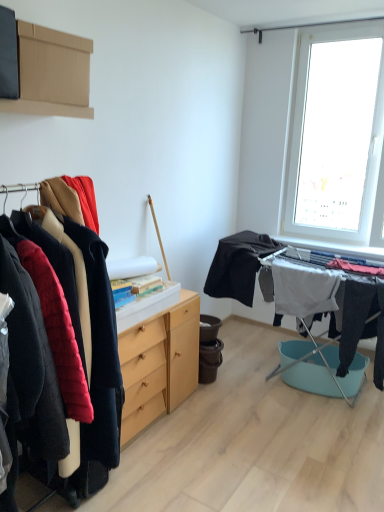
Question: From the image's perspective, does black matte fabric at center, the 2th clothing in the right-to-left sequence, appear higher than white fabric at center, the first clothing in the right-to-left sequence?

Choices:
 (A) no
 (B) yes

Answer: (B)

Question: Is white fabric at center, the 2th clothing viewed from the left, located within black matte fabric at center, the 2th clothing in the right-to-left sequence?

Choices:
 (A) yes
 (B) no

Answer: (B)

Question: Is black matte fabric at center, the 2th clothing in the right-to-left sequence, facing towards white fabric at center, the 2th clothing viewed from the left?

Choices:
 (A) yes
 (B) no

Answer: (B)

Question: Considering the relative positions of black matte fabric at center, the 2th clothing in the right-to-left sequence, and white fabric at center, the first clothing in the right-to-left sequence, in the image provided, is black matte fabric at center, the 2th clothing in the right-to-left sequence, to the right of white fabric at center, the first clothing in the right-to-left sequence, from the viewer's perspective?

Choices:
 (A) yes
 (B) no

Answer: (B)

Question: Is black matte fabric at center, which appears as the 1th clothing when viewed from the left, thinner than white fabric at center, the 2th clothing viewed from the left?

Choices:
 (A) no
 (B) yes

Answer: (A)

Question: Considering the positions of light wood chest of drawers at center and white fabric at center, the first clothing in the right-to-left sequence, in the image, is light wood chest of drawers at center wider or thinner than white fabric at center, the first clothing in the right-to-left sequence,?

Choices:
 (A) thin
 (B) wide

Answer: (B)

Question: Would you say light wood chest of drawers at center is to the left or to the right of white fabric at center, the 2th clothing viewed from the left, in the picture?

Choices:
 (A) left
 (B) right

Answer: (A)

Question: From a real-world perspective, is light wood chest of drawers at center physically located above or below white fabric at center, the first clothing in the right-to-left sequence?

Choices:
 (A) above
 (B) below

Answer: (B)

Question: From the image's perspective, is light wood chest of drawers at center above or below white fabric at center, the 2th clothing viewed from the left?

Choices:
 (A) above
 (B) below

Answer: (B)

Question: From a real-world perspective, is light wood chest of drawers at center above or below brown cardboard box at upper left?

Choices:
 (A) above
 (B) below

Answer: (B)

Question: In the image, is light wood chest of drawers at center positioned in front of or behind brown cardboard box at upper left?

Choices:
 (A) front
 (B) behind

Answer: (B)

Question: Is point (127, 420) positioned closer to the camera than point (29, 40)?

Choices:
 (A) farther
 (B) closer

Answer: (A)

Question: Choose the correct answer: Is light wood chest of drawers at center inside brown cardboard box at upper left or outside it?

Choices:
 (A) outside
 (B) inside

Answer: (A)

Question: From a real-world perspective, is black matte fabric at center, which appears as the 1th clothing when viewed from the left, positioned above or below white fabric at center, the 2th clothing viewed from the left?

Choices:
 (A) above
 (B) below

Answer: (A)

Question: Is point (238, 285) closer or farther from the camera than point (319, 298)?

Choices:
 (A) closer
 (B) farther

Answer: (B)